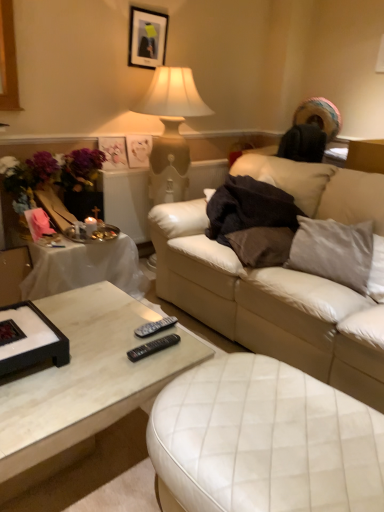
The image size is (384, 512). I want to click on vacant space to the right of matte plastic picture frame at upper left, the 3th picture frame when ordered from top to bottom, so click(129, 170).